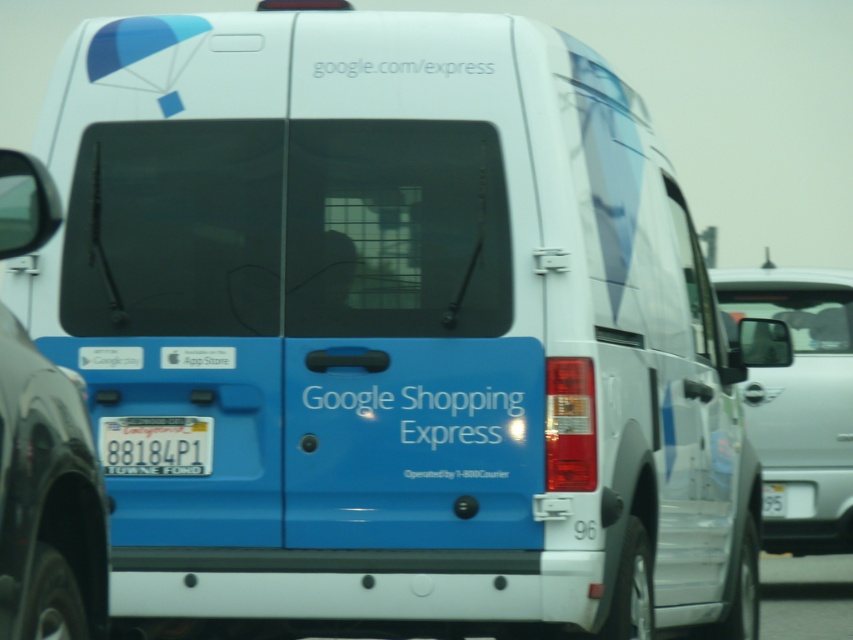
In the scene shown: You are standing in front of a white van with blue accents. There is a point marked at coordinates (x=799, y=404). What object is located at this point?

The point at coordinates (x=799, y=404) corresponds to the silver metallic van at right.

You are standing in front of the silver metallic van at right and the yellow matte license plate at lower center. Which object is taller?

The silver metallic van at right is taller than the yellow matte license plate at lower center.

You are standing in front of the Google Shopping Express van and want to take a photo of the license plate. You notice two points marked on the van at coordinates point (817, 403) and point (143, 465). Which point is closer to the camera so that you can focus your shot on it?

Point (143, 465) is closer to the camera than point (817, 403), so you should focus on point (143, 465) to capture the license plate clearly.